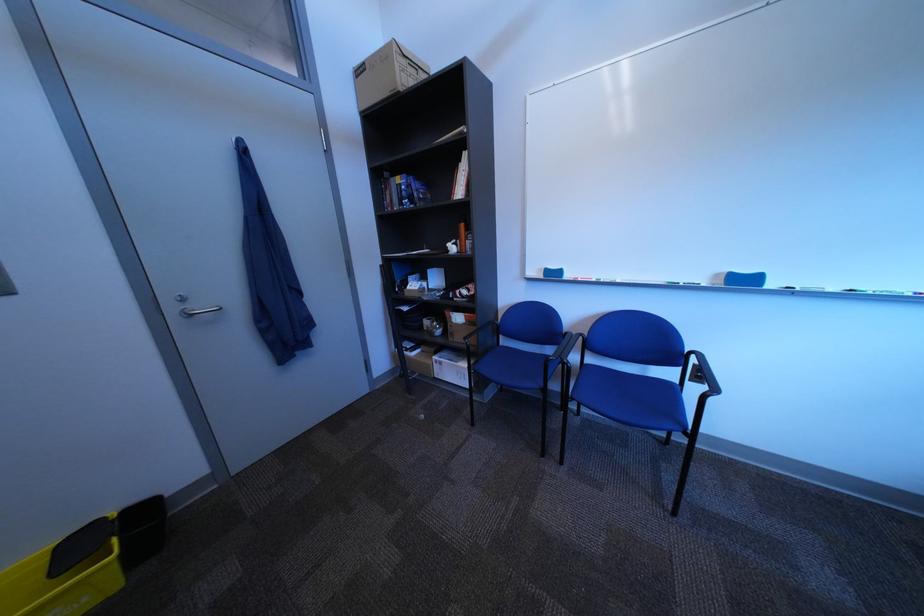
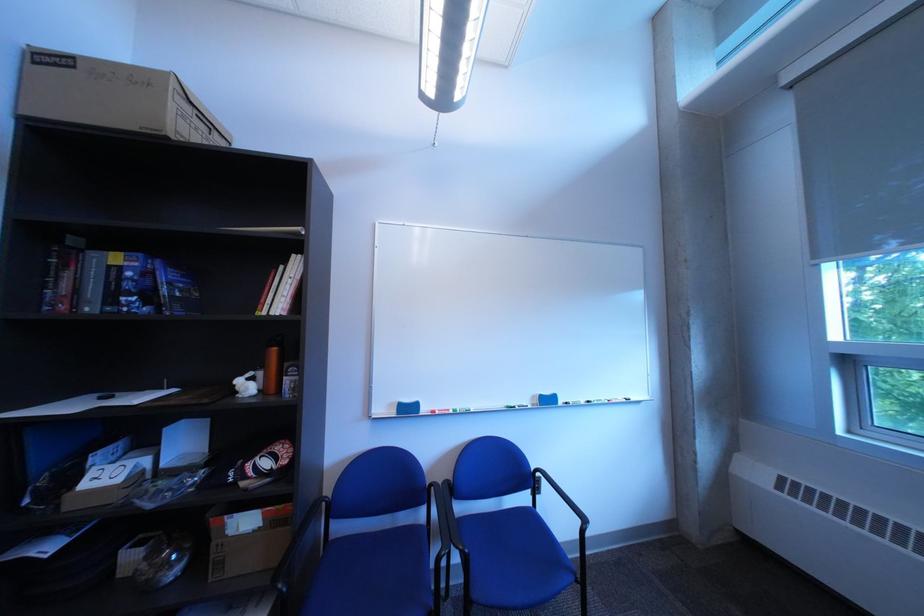
Where in the second image is the point corresponding to [463,249] from the first image?

(249, 387)